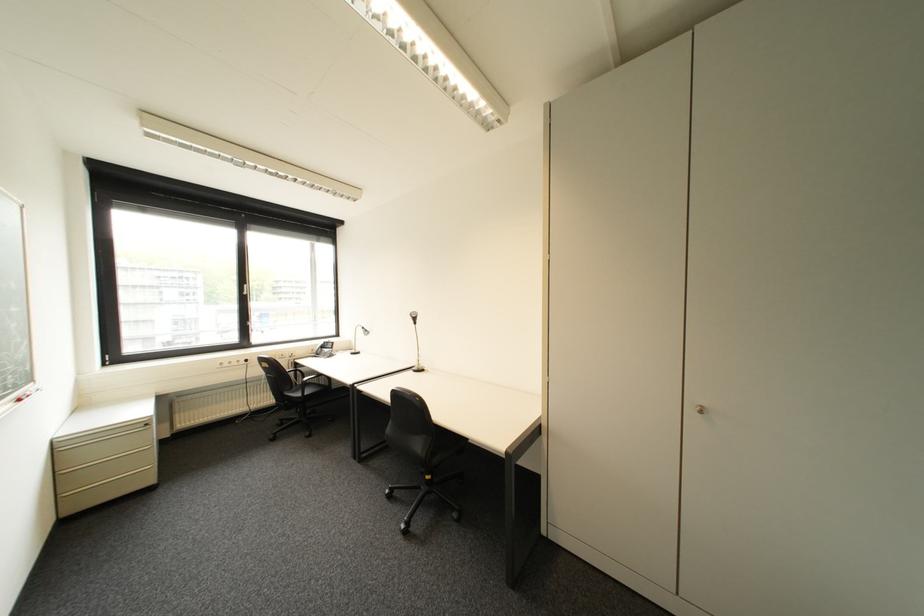
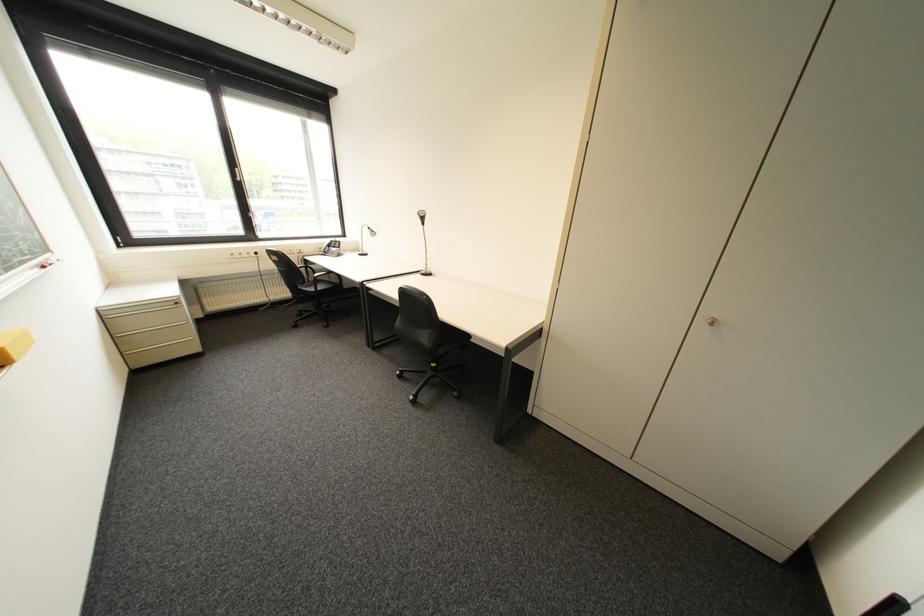
Locate, in the second image, the point that corresponds to point 254,294 in the first image.

(249, 180)